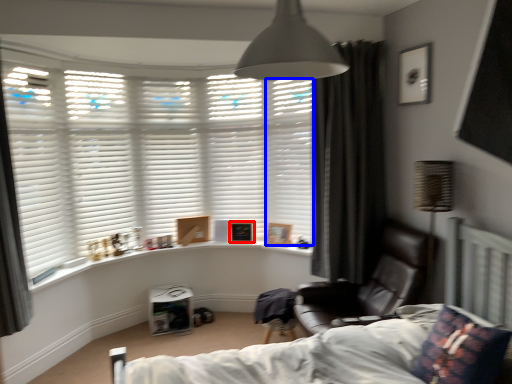
Question: Which point is further to the camera, picture frame (highlighted by a red box) or shutter (highlighted by a blue box)?

Choices:
 (A) picture frame
 (B) shutter

Answer: (A)